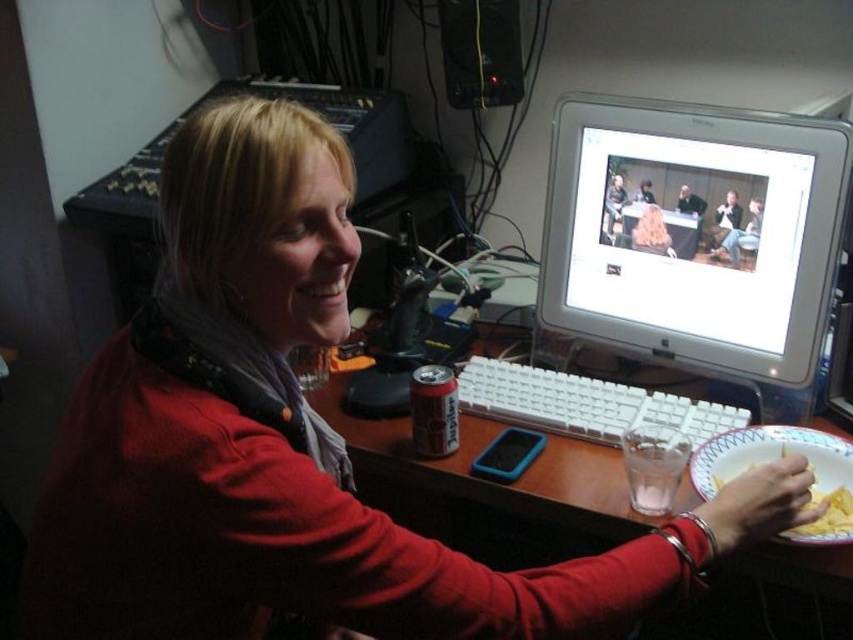
Question: Among these objects, which one is farthest from the camera?

Choices:
 (A) white paper plate at lower right
 (B) white plastic keyboard at center

Answer: (B)

Question: Does wooden desk at center appear on the right side of white paper plate at lower right?

Choices:
 (A) yes
 (B) no

Answer: (B)

Question: In this image, where is wooden desk at center located relative to white paper plate at lower right?

Choices:
 (A) above
 (B) below

Answer: (A)

Question: Estimate the real-world distances between objects in this image. Which object is closer to the wooden desk at center?

Choices:
 (A) white plastic keyboard at center
 (B) white glossy monitor at upper center
 (C) white paper plate at lower right

Answer: (A)

Question: Can you confirm if wooden desk at center is wider than white plastic keyboard at center?

Choices:
 (A) no
 (B) yes

Answer: (B)

Question: Among these points, which one is nearest to the camera?

Choices:
 (A) (618, 502)
 (B) (827, 436)
 (C) (807, 120)
 (D) (547, 378)

Answer: (A)